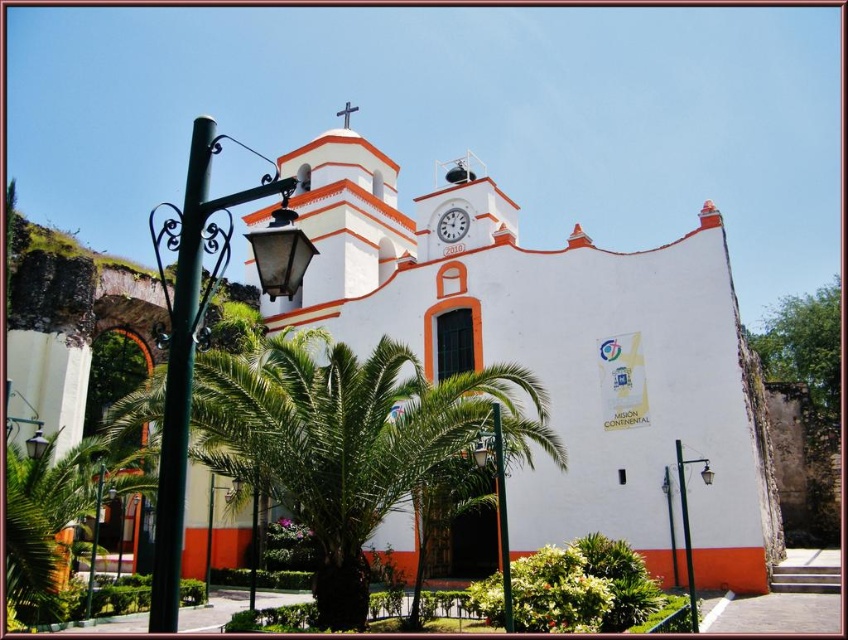
Question: Which object is positioned farthest from the green metallic pole at center?

Choices:
 (A) white glossy clock at center
 (B) green leafy palm tree at center

Answer: (A)

Question: Which of the following is the farthest from the observer?

Choices:
 (A) black metal streetlight at lower right
 (B) green metallic pole at center
 (C) green leafy palm tree at center
 (D) green wrought iron streetlight at left

Answer: (A)

Question: Which point is farther to the camera?

Choices:
 (A) black metal streetlight at lower right
 (B) white glossy clock at center
 (C) green leafy palm tree at center
 (D) orange matte spire at upper center

Answer: (D)

Question: In this image, where is green wrought iron streetlight at left located relative to white glossy clock at center?

Choices:
 (A) right
 (B) left

Answer: (B)

Question: Is white stucco chapel at center above green wrought iron pole at left?

Choices:
 (A) yes
 (B) no

Answer: (A)

Question: Does green leafy palm tree at center have a larger size compared to orange matte spire at upper center?

Choices:
 (A) yes
 (B) no

Answer: (A)